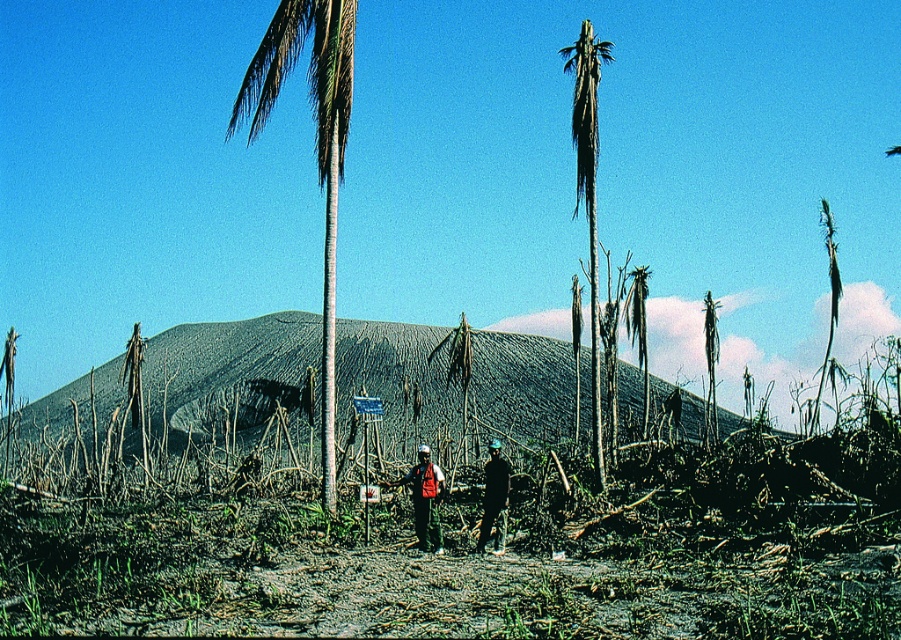
You are standing at the signpost with two people. You want to take a photo of the white smooth palm tree at center. Where should you position yourself relative to the large dark conical structure in the background?

You should position yourself so that the large dark conical structure in the background is behind the white smooth palm tree at center, as the tree is located at point (315, 145) which is in the center of the image. This way, the tree will be in the foreground and the structure will form a natural backdrop in your photo.